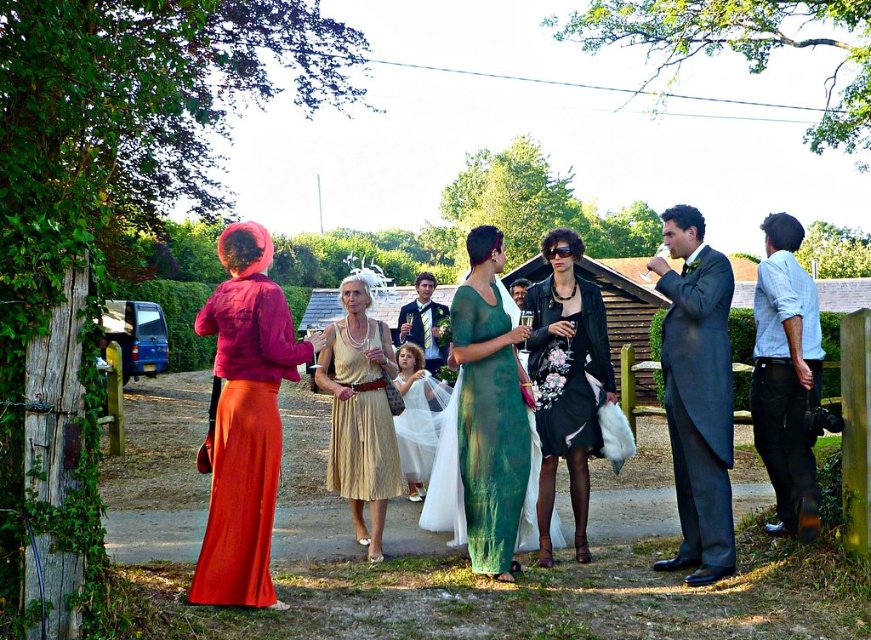
Question: Can you confirm if black leather dress at center is thinner than floral lace dress at center?

Choices:
 (A) yes
 (B) no

Answer: (B)

Question: Which point is farther to the camera?

Choices:
 (A) (429, 282)
 (B) (788, 486)
 (C) (436, 397)
 (D) (551, 266)

Answer: (A)

Question: Observing the image, what is the correct spatial positioning of dark gray suit at right in reference to light blue denim shirt at right?

Choices:
 (A) right
 (B) left

Answer: (B)

Question: Is dark gray suit at right closer to camera compared to formal blue suit at center?

Choices:
 (A) yes
 (B) no

Answer: (A)

Question: Which of the following is the closest to the observer?

Choices:
 (A) matte red dress at left
 (B) gold pleated dress at center
 (C) green silk dress at center
 (D) black leather dress at center

Answer: (A)

Question: Which point is farther to the camera?

Choices:
 (A) gold pleated dress at center
 (B) dark gray suit at right

Answer: (A)